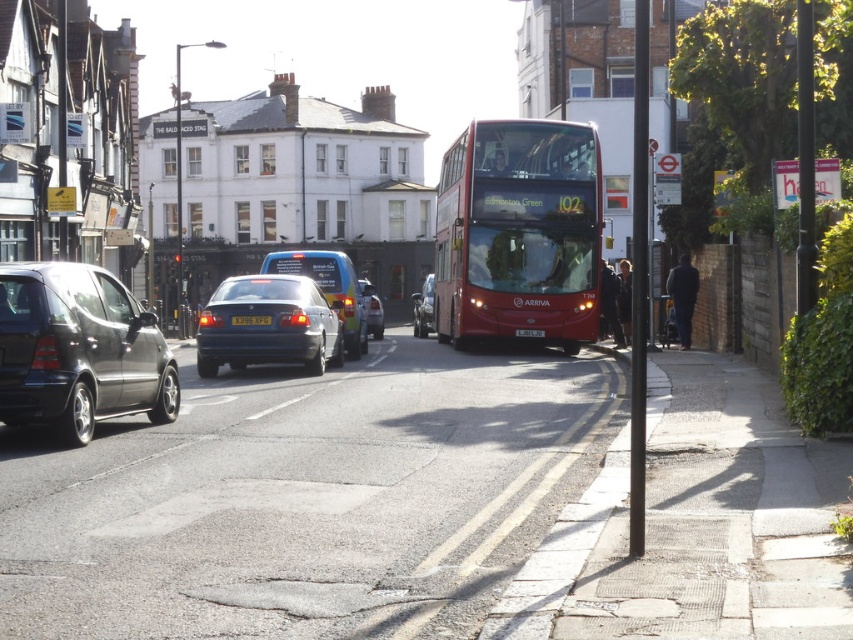
Question: Does shiny red bus at center have a smaller size compared to blue metallic van at center?

Choices:
 (A) yes
 (B) no

Answer: (A)

Question: Which point is farther to the camera?

Choices:
 (A) metallic silver sedan at center
 (B) shiny red bus at center

Answer: (A)

Question: Does shiny red bus at center have a larger size compared to black plastic license plate at center?

Choices:
 (A) yes
 (B) no

Answer: (A)

Question: Does blue metallic van at center appear over black plastic license plate at center?

Choices:
 (A) no
 (B) yes

Answer: (B)

Question: Which object appears farthest from the camera in this image?

Choices:
 (A) matte black hatchback at left
 (B) yellow matte license plate at center
 (C) matte black sedan at center
 (D) blue metallic van at center

Answer: (D)

Question: Which point appears farthest from the camera in this image?

Choices:
 (A) (540, 337)
 (B) (428, 317)
 (C) (305, 317)
 (D) (579, 332)

Answer: (B)